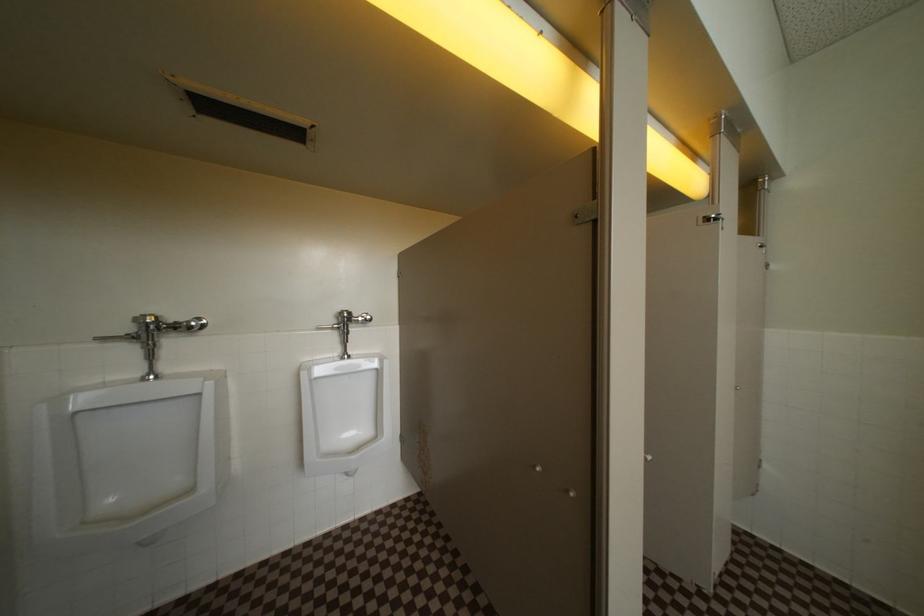
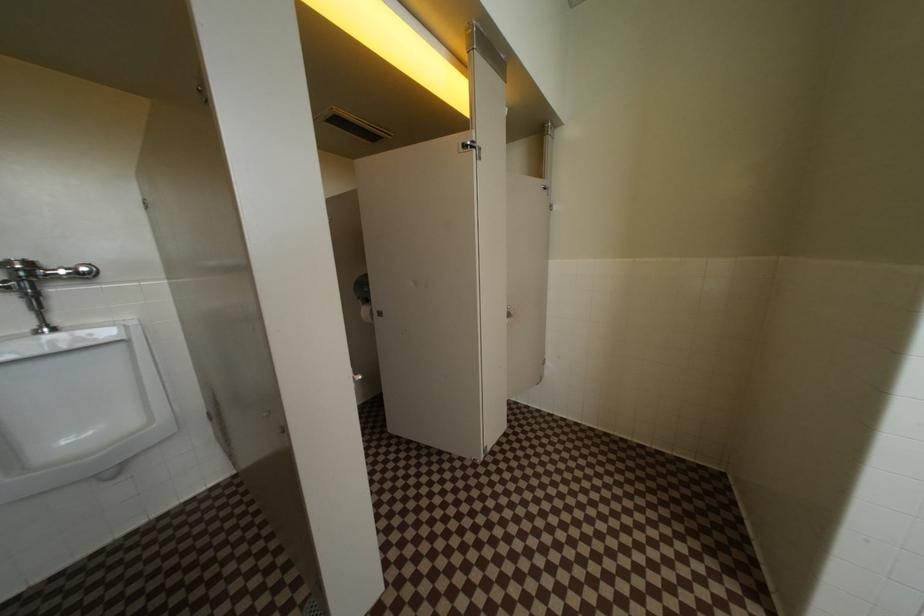
Question: The first image is from the beginning of the video and the second image is from the end. How did the camera likely rotate when shooting the video?

Choices:
 (A) Left
 (B) Right
 (C) Up
 (D) Down

Answer: (B)